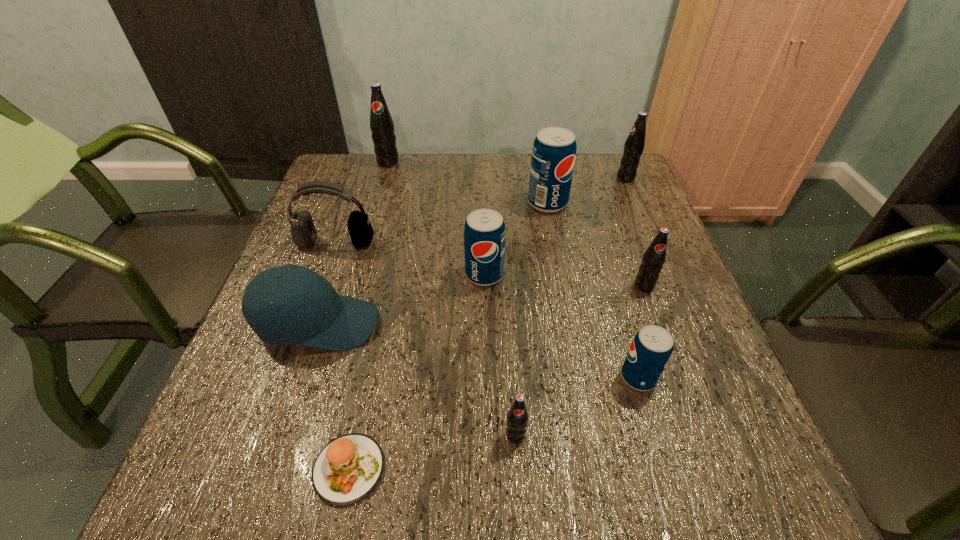
The width and height of the screenshot is (960, 540). Find the location of `vacant space located on the left of the second blue pop from right to left`. vacant space located on the left of the second blue pop from right to left is located at coordinates (475, 202).

Locate an element on the screen. This screenshot has width=960, height=540. blank area located on the front label of the rightmost black pop is located at coordinates (554, 178).

Where is `free space located on the front label of the rightmost black pop`? free space located on the front label of the rightmost black pop is located at coordinates tap(558, 178).

In order to click on free space located 0.310m on the front label of the rightmost black pop in this screenshot , I will do `click(509, 178)`.

You are a GUI agent. You are given a task and a screenshot of the screen. Output one action in this format:
    pyautogui.click(x=<x>, y=<y>)
    Task: Click on the vacant space located on the headband of the black headset
    Image resolution: width=960 pixels, height=540 pixels.
    Given the screenshot: What is the action you would take?
    pyautogui.click(x=307, y=321)

Where is `vacant region located on the back of the leftmost blue pop`? vacant region located on the back of the leftmost blue pop is located at coordinates [484, 214].

Locate an element on the screen. The image size is (960, 540). vacant space located 0.080m on the front label of the sixth pop from left to right is located at coordinates (658, 321).

Find the location of a particular element. free spot located on the front-facing side of the baseball cap is located at coordinates (556, 324).

The height and width of the screenshot is (540, 960). Identify the location of vacant area situated on the left of the third nearest object. (506, 377).

The image size is (960, 540). Find the location of `vacant region located 0.190m on the left of the patty`. vacant region located 0.190m on the left of the patty is located at coordinates (192, 469).